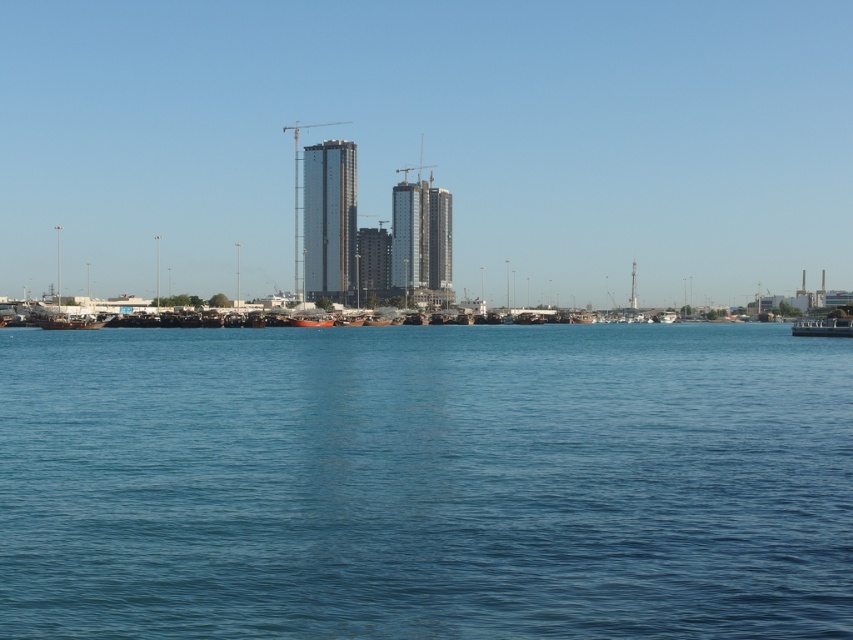
Looking at this image, who is lower down, wooden boat at lower right or red wooden boat at center?

wooden boat at lower right is below.

Which of these two, wooden boat at lower right or red wooden boat at center, stands shorter?

red wooden boat at center

Is point (798, 336) behind point (322, 312)?

No.

What are the coordinates of `wooden boat at lower right` in the screenshot? It's located at (822, 326).

Consider the image. Who is positioned more to the left, blue water at center or red wooden boat at center?

red wooden boat at center is more to the left.

Does blue water at center appear over red wooden boat at center?

Actually, blue water at center is below red wooden boat at center.

Locate an element on the screen. This screenshot has width=853, height=640. blue water at center is located at coordinates (425, 483).

Can you confirm if blue water at center is positioned below wooden boat at lower right?

Correct, blue water at center is located below wooden boat at lower right.

At what (x,y) coordinates should I click in order to perform the action: click on blue water at center. Please return your answer as a coordinate pair (x, y). The width and height of the screenshot is (853, 640). Looking at the image, I should click on (425, 483).